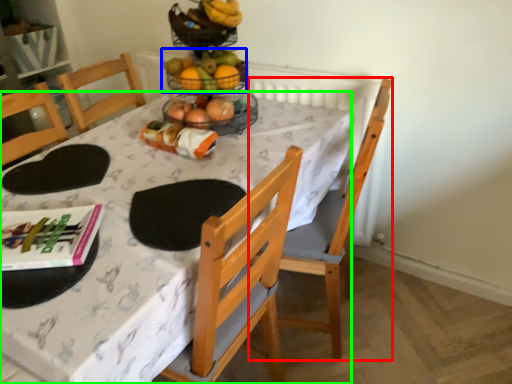
Question: Which is nearer to the chair (highlighted by a red box)? grapefruit (highlighted by a blue box) or desk (highlighted by a green box).

Choices:
 (A) grapefruit
 (B) desk

Answer: (B)